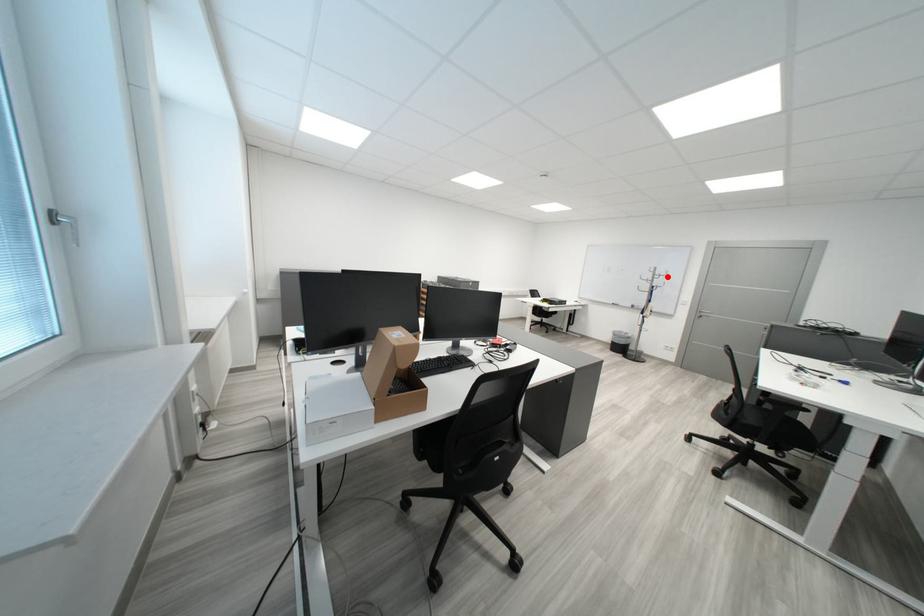
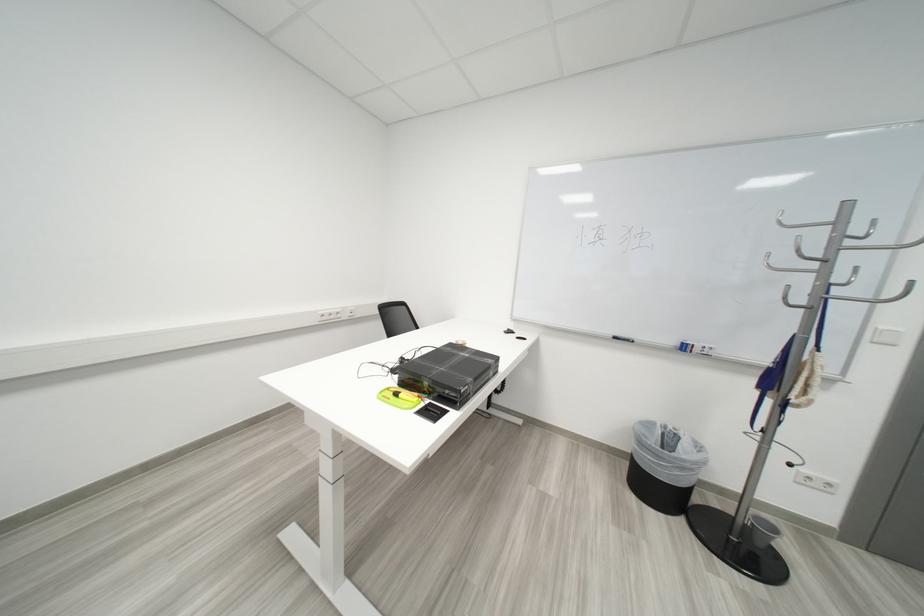
In the second image, find the point that corresponds to the highlighted location in the first image.

(853, 238)